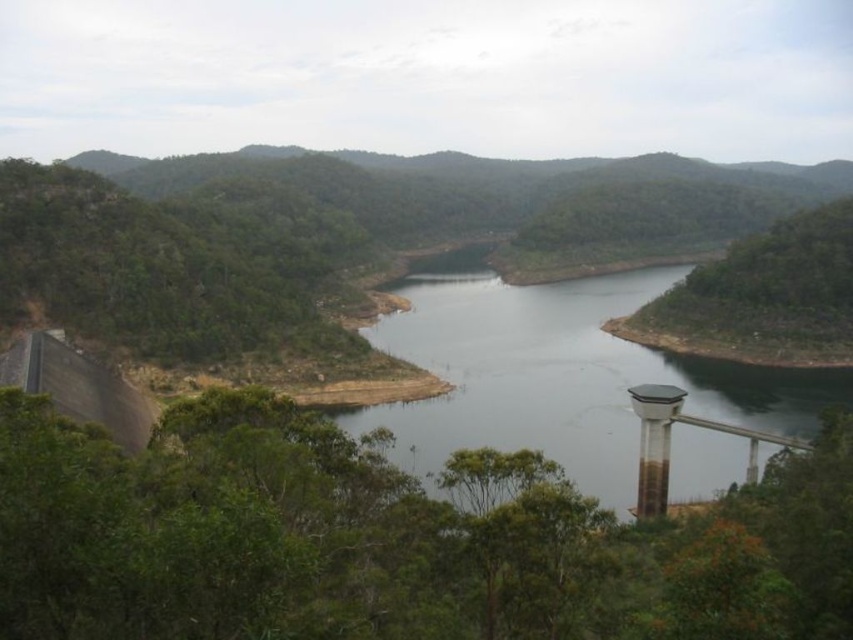
Question: Is dark gray concrete river at center bigger than metallic gray water tower at lower right?

Choices:
 (A) no
 (B) yes

Answer: (B)

Question: Is dark gray concrete river at center wider than metallic gray water tower at lower right?

Choices:
 (A) yes
 (B) no

Answer: (A)

Question: Which object is farther from the camera taking this photo?

Choices:
 (A) metallic gray water tower at lower right
 (B) dark gray concrete river at center

Answer: (A)

Question: Is dark gray concrete river at center to the right of metallic gray water tower at lower right from the viewer's perspective?

Choices:
 (A) no
 (B) yes

Answer: (B)